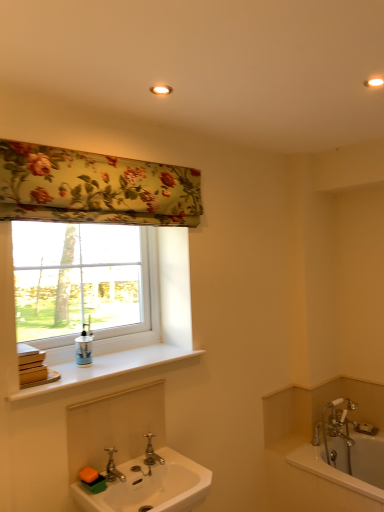
Describe the element at coordinates (85, 286) in the screenshot. I see `white plastic window at upper left` at that location.

The height and width of the screenshot is (512, 384). What do you see at coordinates (108, 368) in the screenshot?
I see `white matte window sill at upper left` at bounding box center [108, 368].

The image size is (384, 512). In order to click on white matte window sill at upper left in this screenshot , I will do `click(108, 368)`.

Locate an element on the screen. white glossy soap dispenser at window is located at coordinates tap(84, 347).

Locate an element on the screen. The image size is (384, 512). white glossy sink at lower left is located at coordinates (150, 486).

Locate an element on the screen. Image resolution: width=384 pixels, height=512 pixels. white plastic window at upper left is located at coordinates (85, 286).

Is polished brass faucet at sink center, the 2th tap in the left-to-right sequence, facing away from matte white recessed light at upper center?

polished brass faucet at sink center, the 2th tap in the left-to-right sequence, does not have its back to matte white recessed light at upper center.

Based on their sizes in the image, would you say polished brass faucet at sink center, acting as the first tap starting from the right, is bigger or smaller than matte white recessed light at upper center?

Considering their sizes, polished brass faucet at sink center, acting as the first tap starting from the right, takes up more space than matte white recessed light at upper center.

Considering the relative sizes of polished brass faucet at sink center, the 2th tap in the left-to-right sequence, and matte white recessed light at upper center in the image provided, is polished brass faucet at sink center, the 2th tap in the left-to-right sequence, taller than matte white recessed light at upper center?

Yes.

Is polished brass faucet at sink center, the 2th tap in the left-to-right sequence, beside matte white recessed light at upper center?

No, polished brass faucet at sink center, the 2th tap in the left-to-right sequence, is not beside matte white recessed light at upper center.

Is floral fabric at upper left to the left or to the right of white glossy soap dispenser at window in the image?

In the image, floral fabric at upper left appears on the right side of white glossy soap dispenser at window.

Which is correct: floral fabric at upper left is inside white glossy soap dispenser at window, or outside of it?

floral fabric at upper left is located beyond the bounds of white glossy soap dispenser at window.

Which of these two, floral fabric at upper left or white glossy soap dispenser at window, stands taller?

With more height is floral fabric at upper left.

Is floral fabric at upper left placed right next to white glossy soap dispenser at window?

There is a gap between floral fabric at upper left and white glossy soap dispenser at window.

Which of these two, white plastic window at upper left or white glossy sink at lower left, is wider?

white glossy sink at lower left is wider.

Is white plastic window at upper left at the left side of white glossy sink at lower left?

Yes, white plastic window at upper left is to the left of white glossy sink at lower left.

Find the location of a particular element. The image size is (384, 512). sink below the white plastic window at upper left (from a real-world perspective) is located at coordinates (150, 486).

Could you tell me if white plastic window at upper left is turned towards white glossy sink at lower left?

No, white plastic window at upper left is not turned towards white glossy sink at lower left.

From the picture: From the image's perspective, is white glossy sink at lower left located above or below floral fabric at upper left?

Based on their image positions, white glossy sink at lower left is located beneath floral fabric at upper left.

In terms of width, does white glossy sink at lower left look wider or thinner when compared to floral fabric at upper left?

white glossy sink at lower left is wider than floral fabric at upper left.

Is white glossy sink at lower left completely or partially outside of floral fabric at upper left?

That's correct, white glossy sink at lower left is outside of floral fabric at upper left.

From the image's perspective, is white glossy bathtub at lower right below white glossy soap dispenser at window?

Yes, from the image's perspective, white glossy bathtub at lower right is beneath white glossy soap dispenser at window.

Does white glossy bathtub at lower right turn towards white glossy soap dispenser at window?

No, white glossy bathtub at lower right is not oriented towards white glossy soap dispenser at window.

Is white glossy bathtub at lower right to the left or to the right of white glossy soap dispenser at window in the image?

Based on their positions, white glossy bathtub at lower right is located to the right of white glossy soap dispenser at window.

Which object is positioned more to the right, floral fabric at upper left or white glossy sink at lower left?

From the viewer's perspective, white glossy sink at lower left appears more on the right side.

Between floral fabric at upper left and white glossy sink at lower left, which one has more height?

With more height is floral fabric at upper left.

Considering the positions of objects floral fabric at upper left and white glossy sink at lower left in the image provided, who is in front, floral fabric at upper left or white glossy sink at lower left?

Positioned in front is white glossy sink at lower left.

Based on the photo, is the surface of floral fabric at upper left in direct contact with white glossy sink at lower left?

No, floral fabric at upper left is not making contact with white glossy sink at lower left.

Does point (65, 224) come in front of point (156, 349)?

Yes, it is in front of point (156, 349).

Relative to white matte window sill at upper left, is white plastic window at upper left in front or behind?

white plastic window at upper left is positioned farther from the viewer than white matte window sill at upper left.

Is white plastic window at upper left surrounding white matte window sill at upper left?

Actually, white matte window sill at upper left is outside white plastic window at upper left.

Is white plastic window at upper left oriented away from white matte window sill at upper left?

white plastic window at upper left is not turned away from white matte window sill at upper left.

Locate an element on the screen. tap that is the 2nd one when counting backward from the matte white recessed light at upper center is located at coordinates (151, 454).

Locate an element on the screen. This screenshot has width=384, height=512. shower curtain in front of the white glossy soap dispenser at window is located at coordinates (94, 188).

Looking at the image, which one is located closer to white plastic window at upper left, polished brass faucet at sink center, acting as the first tap starting from the right, or floral fabric at upper left?

floral fabric at upper left is closer to white plastic window at upper left.

From the image, which object appears to be farther from white plastic window at upper left, white glossy bathtub at lower right or matte white recessed light at upper center?

white glossy bathtub at lower right is further to white plastic window at upper left.

Considering their positions, is matte white recessed light at upper center positioned further to white glossy bathtub at lower right than floral fabric at upper left?

The object further to white glossy bathtub at lower right is matte white recessed light at upper center.

Based on the photo, when comparing their distances from chrome metallic faucet at lower center, the 2th tap positioned from the right, does white glossy bathtub at lower right or matte white recessed light at upper center seem closer?

The object closer to chrome metallic faucet at lower center, the 2th tap positioned from the right, is white glossy bathtub at lower right.

Based on their spatial positions, is white glossy soap dispenser at window or matte white recessed light at upper center further from white plastic window at upper left?

matte white recessed light at upper center is further to white plastic window at upper left.

Estimate the real-world distances between objects in this image. Which object is further from matte white recessed light at upper center, white glossy bathtub at lower right or white glossy sink at lower left?

white glossy bathtub at lower right is positioned further to the anchor matte white recessed light at upper center.

From the image, which object appears to be farther from chrome metallic faucet at lower center, the 2th tap positioned from the right, floral fabric at upper left or white plastic window at upper left?

floral fabric at upper left is positioned further to the anchor chrome metallic faucet at lower center, the 2th tap positioned from the right.

Looking at the image, which one is located closer to chrome metallic faucet at lower center, the 2th tap positioned from the right, white matte window sill at upper left or floral fabric at upper left?

white matte window sill at upper left is closer to chrome metallic faucet at lower center, the 2th tap positioned from the right.

Image resolution: width=384 pixels, height=512 pixels. I want to click on window sill between matte white recessed light at upper center and chrome metallic faucet at lower center, the 1th tap from the front, vertically, so click(108, 368).

Image resolution: width=384 pixels, height=512 pixels. I want to click on soap dispenser between floral fabric at upper left and white matte window sill at upper left in the vertical direction, so click(x=84, y=347).

In order to click on shower curtain between matte white recessed light at upper center and white glossy sink at lower left vertically in this screenshot , I will do `click(94, 188)`.

This screenshot has height=512, width=384. I want to click on window sill between white plastic window at upper left and white glossy sink at lower left in the up-down direction, so click(x=108, y=368).